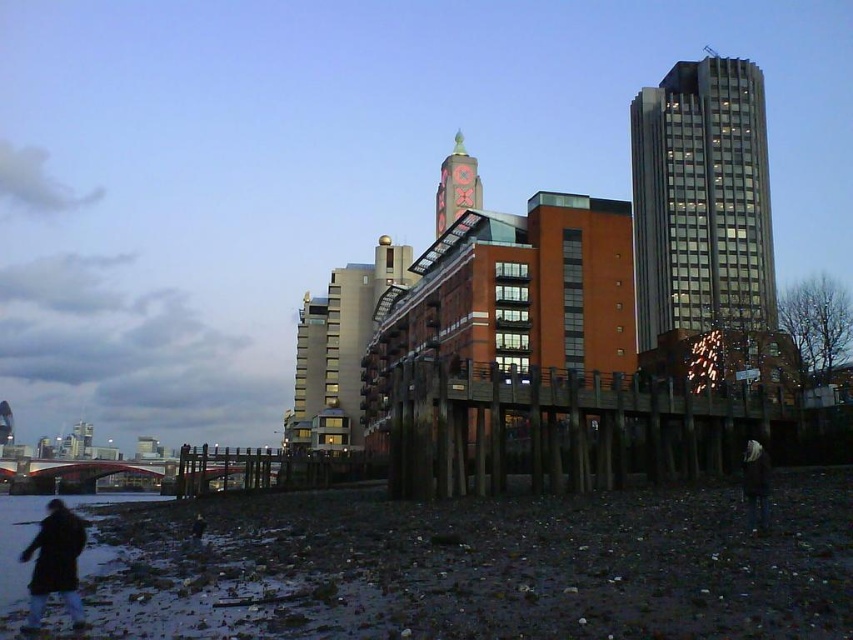
Question: Is brick tower at center wider than dark brown jacket at lower right?

Choices:
 (A) no
 (B) yes

Answer: (A)

Question: Is dark brown coat at lower left thinner than dark brown jacket at lower right?

Choices:
 (A) no
 (B) yes

Answer: (A)

Question: Which object appears farthest from the camera in this image?

Choices:
 (A) dark brown jacket at lower right
 (B) matte glass skyscraper at upper right

Answer: (B)

Question: Which point is farther to the camera?

Choices:
 (A) matte glass skyscraper at upper right
 (B) dark brown jacket at lower right

Answer: (A)

Question: Which object appears farthest from the camera in this image?

Choices:
 (A) brick tower at center
 (B) dark brown coat at lower left

Answer: (A)

Question: Is matte glass skyscraper at upper right behind dark brown coat at lower left?

Choices:
 (A) yes
 (B) no

Answer: (A)